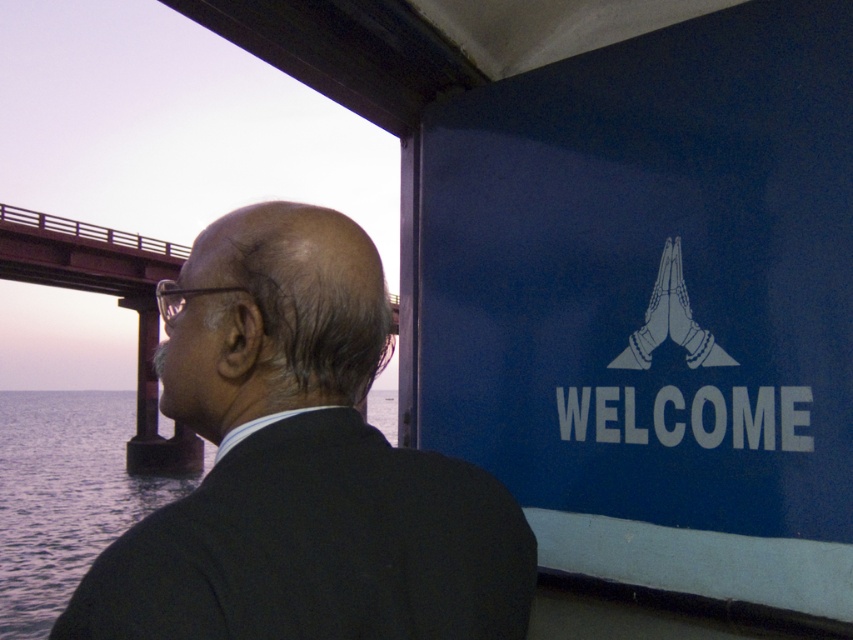
Based on the scene description, where is the black suit at center located in relation to the dark blue water at left?

The black suit at center is to the right of dark blue water at left.

Based on the scene description, which object occupies a greater area in the image between the dark blue water at left and the rusty metal bridge at left?

The dark blue water at left occupies a greater area than the rusty metal bridge at left as stated in the object descriptions.